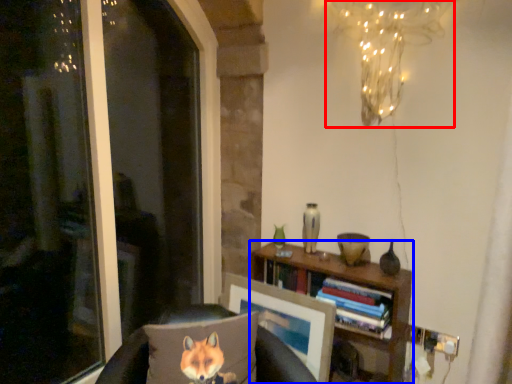
Question: Which object appears farthest to the camera in this image, lamp (highlighted by a red box) or bookcase (highlighted by a blue box)?

Choices:
 (A) lamp
 (B) bookcase

Answer: (B)